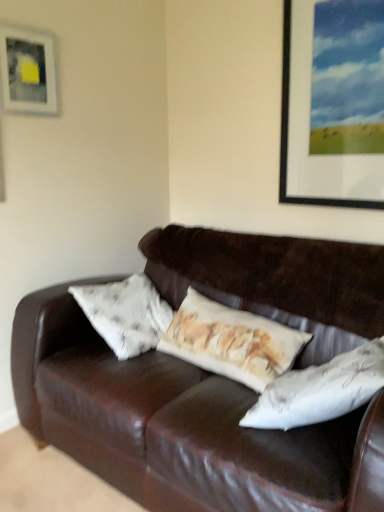
Question: Is point (48, 111) closer or farther from the camera than point (301, 75)?

Choices:
 (A) closer
 (B) farther

Answer: (B)

Question: Is matte white picture frame at upper left, placed as the first picture frame when sorted from left to right, wider or thinner than metallic silver picture frame at upper right, placed as the 2th picture frame when sorted from left to right?

Choices:
 (A) wide
 (B) thin

Answer: (B)

Question: Visually, is matte white picture frame at upper left, placed as the first picture frame when sorted from left to right, positioned to the left or to the right of metallic silver picture frame at upper right, placed as the 2th picture frame when sorted from left to right?

Choices:
 (A) left
 (B) right

Answer: (A)

Question: From their relative heights in the image, would you say metallic silver picture frame at upper right, the first picture frame from the right, is taller or shorter than matte white picture frame at upper left, positioned as the second picture frame in right-to-left order?

Choices:
 (A) tall
 (B) short

Answer: (A)

Question: Is metallic silver picture frame at upper right, placed as the 2th picture frame when sorted from left to right, in front of or behind matte white picture frame at upper left, placed as the first picture frame when sorted from left to right, in the image?

Choices:
 (A) front
 (B) behind

Answer: (A)

Question: Is point (370, 109) closer or farther from the camera than point (41, 42)?

Choices:
 (A) farther
 (B) closer

Answer: (B)

Question: From a real-world perspective, is metallic silver picture frame at upper right, placed as the 2th picture frame when sorted from left to right, above or below matte white picture frame at upper left, positioned as the second picture frame in right-to-left order?

Choices:
 (A) above
 (B) below

Answer: (B)